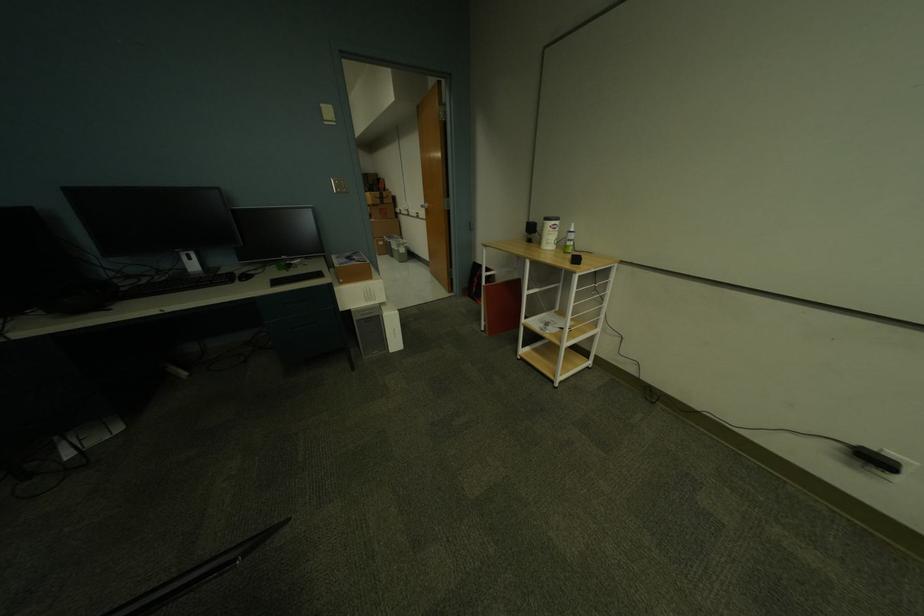
Find the location of a particular element. white light switch is located at coordinates pyautogui.click(x=327, y=113).